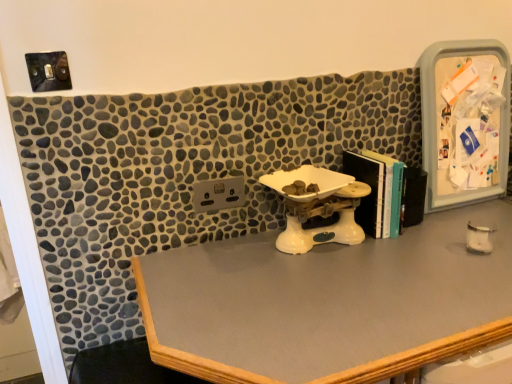
Question: Does white plastic scale at center come in front of smooth gray desk at center?

Choices:
 (A) yes
 (B) no

Answer: (B)

Question: Can we say white plastic scale at center lies outside smooth gray desk at center?

Choices:
 (A) no
 (B) yes

Answer: (B)

Question: Is white plastic scale at center positioned behind smooth gray desk at center?

Choices:
 (A) no
 (B) yes

Answer: (B)

Question: Is white plastic scale at center oriented towards smooth gray desk at center?

Choices:
 (A) no
 (B) yes

Answer: (A)

Question: From a real-world perspective, is white plastic scale at center over smooth gray desk at center?

Choices:
 (A) yes
 (B) no

Answer: (A)

Question: From a real-world perspective, is hardcover books at center-right physically located above or below smooth gray desk at center?

Choices:
 (A) above
 (B) below

Answer: (A)

Question: Looking at their shapes, would you say hardcover books at center-right is wider or thinner than smooth gray desk at center?

Choices:
 (A) wide
 (B) thin

Answer: (B)

Question: Considering the positions of point (395, 208) and point (441, 211), is point (395, 208) closer or farther from the camera than point (441, 211)?

Choices:
 (A) closer
 (B) farther

Answer: (A)

Question: Would you say hardcover books at center-right is to the left or to the right of smooth gray desk at center in the picture?

Choices:
 (A) right
 (B) left

Answer: (B)

Question: Considering the positions of point (311, 329) and point (428, 183), is point (311, 329) closer or farther from the camera than point (428, 183)?

Choices:
 (A) closer
 (B) farther

Answer: (A)

Question: In terms of height, does smooth gray desk at center look taller or shorter compared to plastic/transparent medicine cabinet at right?

Choices:
 (A) tall
 (B) short

Answer: (A)

Question: In the image, is smooth gray desk at center on the left side or the right side of plastic/transparent medicine cabinet at right?

Choices:
 (A) right
 (B) left

Answer: (B)

Question: Is smooth gray desk at center bigger or smaller than plastic/transparent medicine cabinet at right?

Choices:
 (A) small
 (B) big

Answer: (B)

Question: Relative to hardcover books at center-right, is plastic/transparent medicine cabinet at right in front or behind?

Choices:
 (A) behind
 (B) front

Answer: (A)

Question: Does point (x=432, y=104) appear closer or farther from the camera than point (x=377, y=168)?

Choices:
 (A) closer
 (B) farther

Answer: (B)